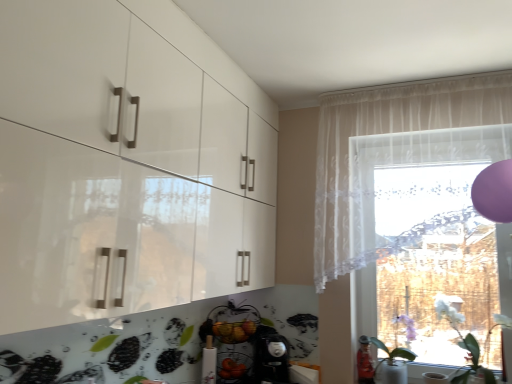
Find the location of a particular element. This screenshot has height=384, width=512. vacant space situated above sheer white curtain at upper right (from a real-world perspective) is located at coordinates (383, 82).